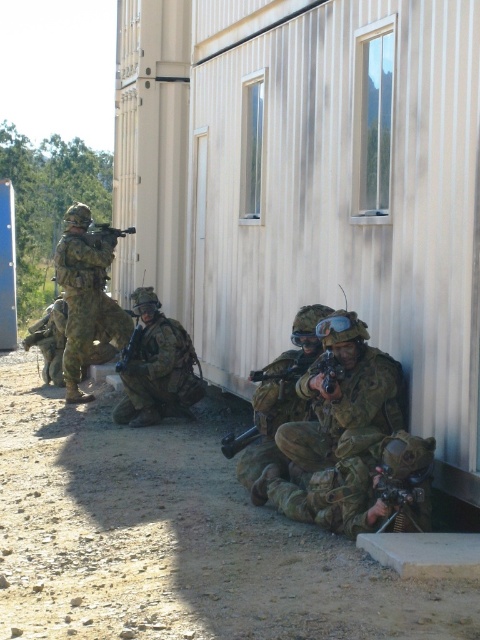
Which is above, camouflage fabric helmet at lower right or matte black rifle at upper left?

Positioned higher is matte black rifle at upper left.

Consider the image. Is camouflage fabric helmet at lower right to the right of matte black rifle at upper left from the viewer's perspective?

Yes, camouflage fabric helmet at lower right is to the right of matte black rifle at upper left.

Find the location of a particular element. camouflage fabric helmet at lower right is located at coordinates (280, 396).

Looking at this image, can you confirm if camouflage fabric helmet at center is positioned to the right of matte black rifle at center?

Indeed, camouflage fabric helmet at center is positioned on the right side of matte black rifle at center.

What do you see at coordinates (156, 365) in the screenshot?
I see `camouflage fabric helmet at center` at bounding box center [156, 365].

Is point (178, 332) positioned behind point (132, 356)?

No, it is not.

Where is `camouflage fabric helmet at center`? camouflage fabric helmet at center is located at coordinates (156, 365).

Who is positioned more to the left, camouflage fabric helmet at center or camouflage fabric helmet at lower left?

camouflage fabric helmet at lower left

Is camouflage fabric helmet at center to the left of camouflage fabric helmet at lower left from the viewer's perspective?

Incorrect, camouflage fabric helmet at center is not on the left side of camouflage fabric helmet at lower left.

Does point (168, 385) lie in front of point (55, 365)?

Yes.

Identify the location of camouflage fabric helmet at center. The width and height of the screenshot is (480, 640). (156, 365).